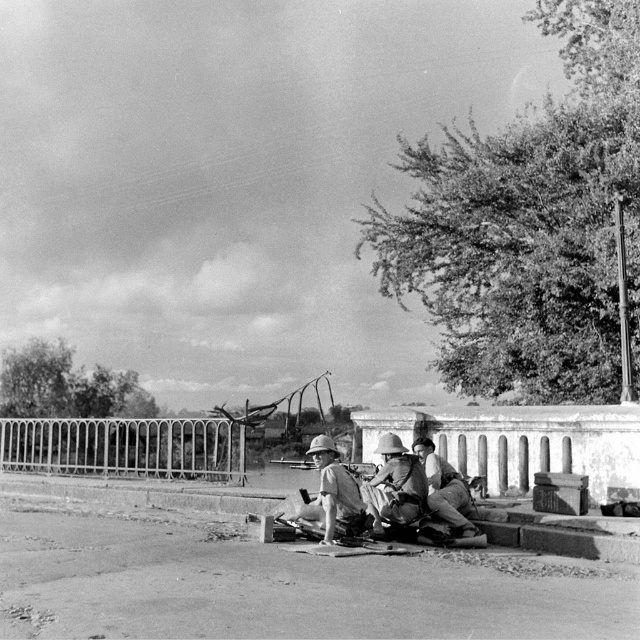
Who is shorter, light brown wooden stick at center or camouflage fabric construction worker at center?

Standing shorter between the two is light brown wooden stick at center.

Is light brown wooden stick at center closer to the viewer compared to camouflage fabric construction worker at center?

That is True.

Does point (353, 486) come behind point (433, 484)?

No, (353, 486) is closer to viewer.

You are a GUI agent. You are given a task and a screenshot of the screen. Output one action in this format:
    pyautogui.click(x=<x>, y=<y>)
    Task: Click on the light brown wooden stick at center
    The height and width of the screenshot is (640, 640).
    Given the screenshot: What is the action you would take?
    pyautogui.click(x=332, y=492)

Does camouflage fabric helmet at center have a smaller size compared to camouflage fabric construction worker at center?

Correct, camouflage fabric helmet at center occupies less space than camouflage fabric construction worker at center.

Is camouflage fabric helmet at center thinner than camouflage fabric construction worker at center?

Incorrect, camouflage fabric helmet at center's width is not less than camouflage fabric construction worker at center's.

Who is more forward, (420, 497) or (467, 518)?

Point (420, 497) is more forward.

The width and height of the screenshot is (640, 640). Identify the location of camouflage fabric helmet at center. (394, 484).

Between point (88, 460) and point (364, 524), which one is positioned behind?

Point (88, 460)

Is metallic wire fence at center smaller than light brown wooden stick at center?

Correct, metallic wire fence at center occupies less space than light brown wooden stick at center.

Find the location of a particular element. The height and width of the screenshot is (640, 640). metallic wire fence at center is located at coordinates (124, 445).